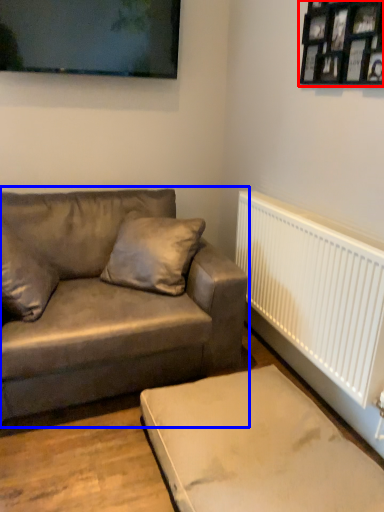
Question: Which of the following is the farthest to the observer, picture frame (highlighted by a red box) or studio couch (highlighted by a blue box)?

Choices:
 (A) picture frame
 (B) studio couch

Answer: (B)